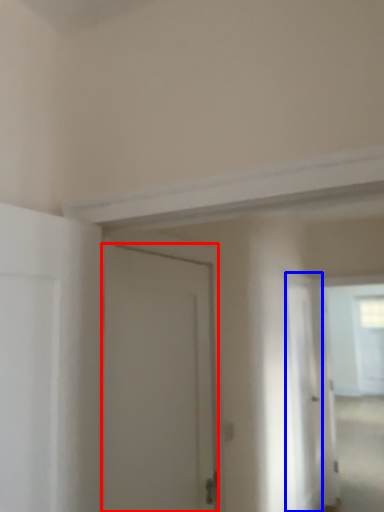
Question: Among these objects, which one is nearest to the camera, door (highlighted by a red box) or screen door (highlighted by a blue box)?

Choices:
 (A) door
 (B) screen door

Answer: (A)